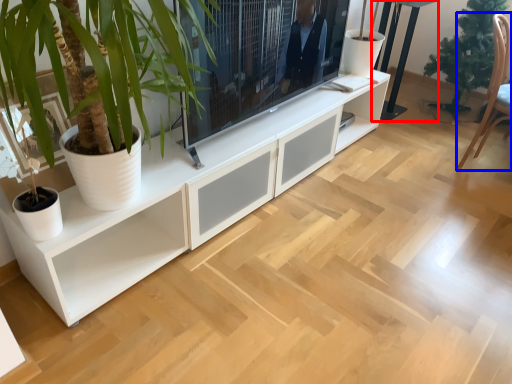
Question: Which object appears closest to the camera in this image, table (highlighted by a red box) or armchair (highlighted by a blue box)?

Choices:
 (A) table
 (B) armchair

Answer: (B)